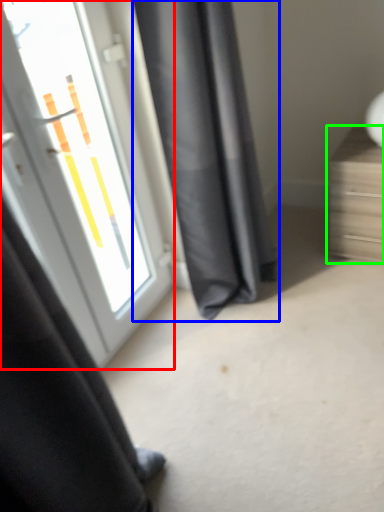
Question: Estimate the real-world distances between objects in this image. Which object is closer to door (highlighted by a red box), curtain (highlighted by a blue box) or furniture (highlighted by a green box)?

Choices:
 (A) curtain
 (B) furniture

Answer: (A)